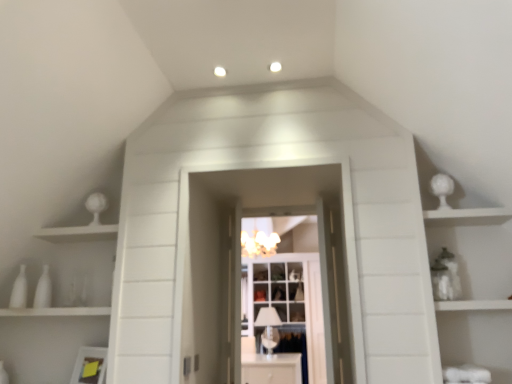
Question: Can you confirm if white glossy vases at left is positioned to the right of white glossy cabinet at center?

Choices:
 (A) yes
 (B) no

Answer: (B)

Question: Does white glossy vases at left have a greater height compared to white glossy cabinet at center?

Choices:
 (A) yes
 (B) no

Answer: (A)

Question: Considering the relative positions of white glossy vases at left and white glossy cabinet at center in the image provided, is white glossy vases at left to the left of white glossy cabinet at center from the viewer's perspective?

Choices:
 (A) no
 (B) yes

Answer: (B)

Question: Is white glossy vases at left not inside white glossy cabinet at center?

Choices:
 (A) no
 (B) yes

Answer: (B)

Question: Could you tell me if white glossy vases at left is facing white glossy cabinet at center?

Choices:
 (A) yes
 (B) no

Answer: (B)

Question: In terms of height, does clear glass cabinet at center look taller or shorter compared to white glossy vases at left?

Choices:
 (A) short
 (B) tall

Answer: (B)

Question: Considering the relative positions of clear glass cabinet at center and white glossy vases at left in the image provided, is clear glass cabinet at center to the left or to the right of white glossy vases at left?

Choices:
 (A) left
 (B) right

Answer: (B)

Question: From a real-world perspective, is clear glass cabinet at center positioned above or below white glossy vases at left?

Choices:
 (A) above
 (B) below

Answer: (A)

Question: Is clear glass cabinet at center wider or thinner than white glossy vases at left?

Choices:
 (A) wide
 (B) thin

Answer: (A)

Question: Based on their positions, is white glossy sphere at upper right located to the left or right of white frosted glass light fixture at center?

Choices:
 (A) left
 (B) right

Answer: (B)

Question: Considering their positions, is white glossy sphere at upper right located in front of or behind white frosted glass light fixture at center?

Choices:
 (A) front
 (B) behind

Answer: (A)

Question: Is white glossy sphere at upper right spatially inside white frosted glass light fixture at center, or outside of it?

Choices:
 (A) inside
 (B) outside

Answer: (B)

Question: Looking at the image, does white glossy sphere at upper right seem bigger or smaller compared to white frosted glass light fixture at center?

Choices:
 (A) small
 (B) big

Answer: (B)

Question: From a real-world perspective, is white glossy door at center above or below clear glass cabinet at center?

Choices:
 (A) below
 (B) above

Answer: (A)

Question: Visually, is white glossy door at center positioned to the left or to the right of clear glass cabinet at center?

Choices:
 (A) right
 (B) left

Answer: (B)